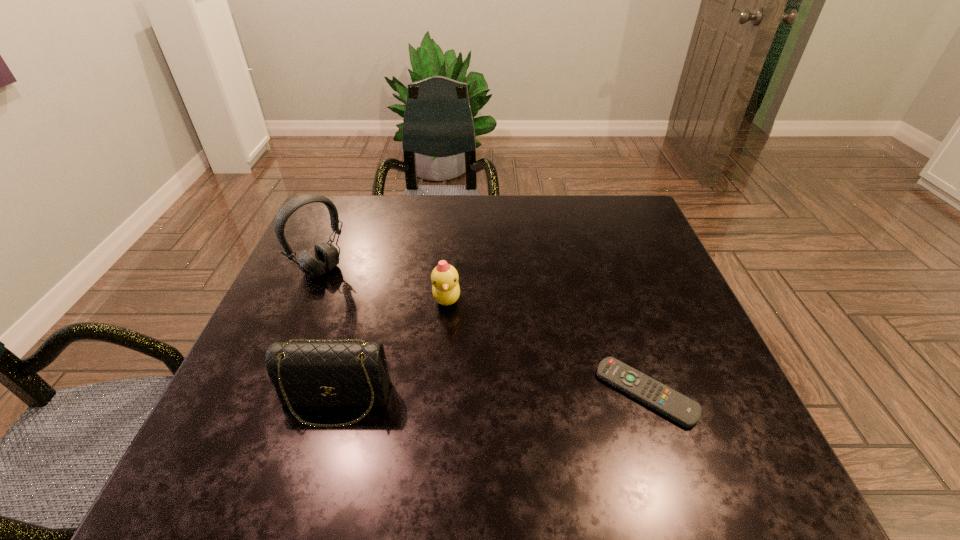
Identify the location of clutch bag. The height and width of the screenshot is (540, 960). (341, 373).

Identify the location of the rightmost object. (676, 406).

Find the location of `remote control`. remote control is located at coordinates (676, 406).

Locate an element on the screen. The height and width of the screenshot is (540, 960). duckling is located at coordinates (446, 290).

At what (x,y) coordinates should I click in order to perform the action: click on the tallest object. Please return your answer as a coordinate pair (x, y). Looking at the image, I should click on (326, 257).

Find the location of a particular element. blank area located on the left of the rightmost object is located at coordinates (548, 392).

I want to click on vacant space situated 0.060m on the front-facing side of the second object from right to left, so click(x=464, y=333).

I want to click on vacant space situated 0.270m on the front-facing side of the second object from right to left, so click(x=513, y=408).

I want to click on vacant space located on the front-facing side of the second object from right to left, so click(x=502, y=392).

What are the coordinates of `vacant space situated 0.300m on the front-facing side of the tallest object` in the screenshot? It's located at (414, 347).